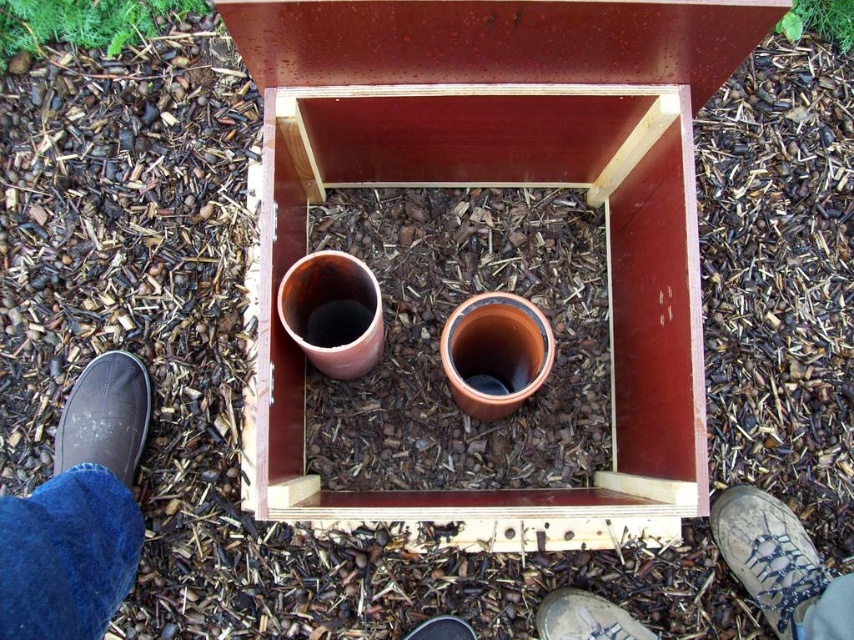
Question: Which of the following is the farthest from the observer?

Choices:
 (A) black leather shoe at lower center
 (B) dark blue denim jeans at lower left

Answer: (A)

Question: Which object appears farthest from the camera in this image?

Choices:
 (A) dark gray canvas shoe at lower left
 (B) camouflage fabric boot at lower right
 (C) terracotta clay pots at center

Answer: (A)

Question: Does dark gray canvas shoe at lower left appear on the left side of black leather shoe at lower center?

Choices:
 (A) no
 (B) yes

Answer: (B)

Question: Does terracotta clay pots at center have a greater width compared to camouflage fabric boot at lower right?

Choices:
 (A) yes
 (B) no

Answer: (A)

Question: Is terracotta clay pots at center above black leather shoe at lower center?

Choices:
 (A) no
 (B) yes

Answer: (B)

Question: Among these points, which one is farthest from the camera?

Choices:
 (A) (79, 445)
 (B) (540, 508)

Answer: (A)